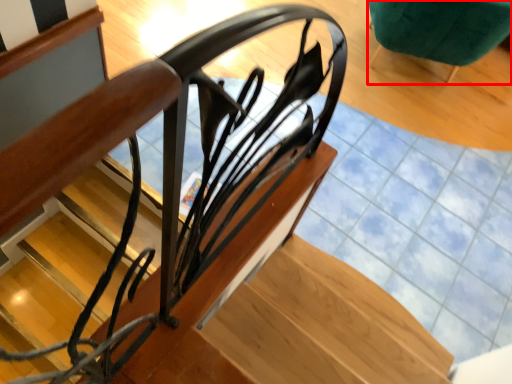
Question: From the image's perspective, where is furniture (annotated by the red box) located relative to stairs?

Choices:
 (A) above
 (B) below

Answer: (A)